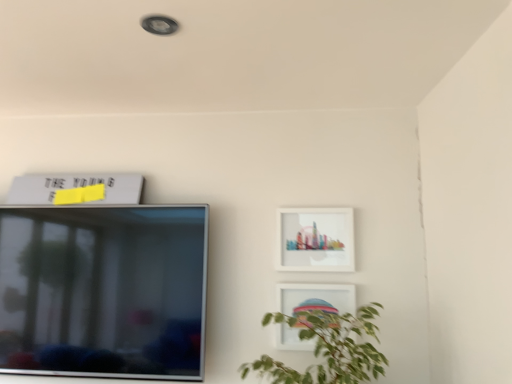
Question: From a real-world perspective, is matte white picture frame at upper right, arranged as the 2th picture frame when viewed from the top, positioned under white matte picture frame at upper left, the 3th picture frame from the bottom, based on gravity?

Choices:
 (A) yes
 (B) no

Answer: (A)

Question: Could you tell me if matte white picture frame at upper right, which is the first picture frame in right-to-left order, is facing white matte picture frame at upper left, marked as the 1th picture frame in a left-to-right arrangement?

Choices:
 (A) yes
 (B) no

Answer: (B)

Question: Is matte white picture frame at upper right, arranged as the 2th picture frame when viewed from the top, closer to the viewer compared to white matte picture frame at upper left, marked as the 3th picture frame in a right-to-left arrangement?

Choices:
 (A) no
 (B) yes

Answer: (B)

Question: Considering the relative positions of matte white picture frame at upper right, which is the first picture frame in right-to-left order, and white matte picture frame at upper left, marked as the 1th picture frame in a left-to-right arrangement, in the image provided, is matte white picture frame at upper right, which is the first picture frame in right-to-left order, to the right of white matte picture frame at upper left, marked as the 1th picture frame in a left-to-right arrangement, from the viewer's perspective?

Choices:
 (A) yes
 (B) no

Answer: (A)

Question: Does matte white picture frame at upper right, acting as the 3th picture frame starting from the left, have a larger size compared to white matte picture frame at upper left, the 1th picture frame in the top-to-bottom sequence?

Choices:
 (A) yes
 (B) no

Answer: (B)

Question: Is matte white picture frame at upper right, arranged as the 2th picture frame when viewed from the top, completely or partially outside of white matte picture frame at upper left, marked as the 3th picture frame in a right-to-left arrangement?

Choices:
 (A) yes
 (B) no

Answer: (A)

Question: Is white glossy picture frame at lower right, the first picture frame in the bottom-to-top sequence, far away from white matte picture frame at upper left, the 3th picture frame from the bottom?

Choices:
 (A) yes
 (B) no

Answer: (B)

Question: Is white glossy picture frame at lower right, which is the 2th picture frame in left-to-right order, positioned before white matte picture frame at upper left, the 3th picture frame from the bottom?

Choices:
 (A) yes
 (B) no

Answer: (A)

Question: Considering the relative positions of white glossy picture frame at lower right, which is the 2th picture frame in left-to-right order, and white matte picture frame at upper left, the 3th picture frame from the bottom, in the image provided, is white glossy picture frame at lower right, which is the 2th picture frame in left-to-right order, to the right of white matte picture frame at upper left, the 3th picture frame from the bottom, from the viewer's perspective?

Choices:
 (A) yes
 (B) no

Answer: (A)

Question: Is white glossy picture frame at lower right, the first picture frame in the bottom-to-top sequence, oriented away from white matte picture frame at upper left, the 1th picture frame in the top-to-bottom sequence?

Choices:
 (A) yes
 (B) no

Answer: (B)

Question: Is white glossy picture frame at lower right, which appears as the second picture frame when viewed from the right, positioned beyond the bounds of white matte picture frame at upper left, marked as the 1th picture frame in a left-to-right arrangement?

Choices:
 (A) no
 (B) yes

Answer: (B)

Question: From a real-world perspective, is white glossy picture frame at lower right, which appears as the third picture frame when viewed from the top, located beneath white matte picture frame at upper left, the 3th picture frame from the bottom?

Choices:
 (A) no
 (B) yes

Answer: (B)

Question: Considering the relative positions of matte white picture frame at upper right, acting as the second picture frame starting from the bottom, and white glossy picture frame at lower right, which appears as the second picture frame when viewed from the right, in the image provided, is matte white picture frame at upper right, acting as the second picture frame starting from the bottom, to the right of white glossy picture frame at lower right, which appears as the second picture frame when viewed from the right, from the viewer's perspective?

Choices:
 (A) no
 (B) yes

Answer: (B)